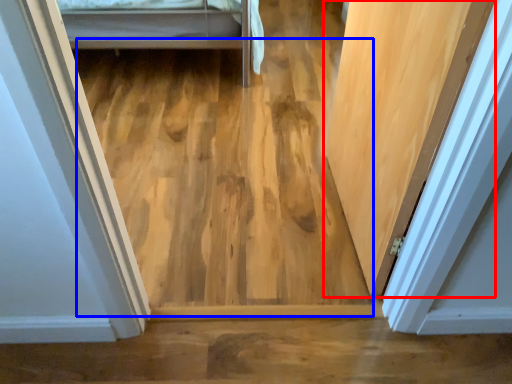
Question: Which object is further to the camera taking this photo, door (highlighted by a red box) or plywood (highlighted by a blue box)?

Choices:
 (A) door
 (B) plywood

Answer: (B)